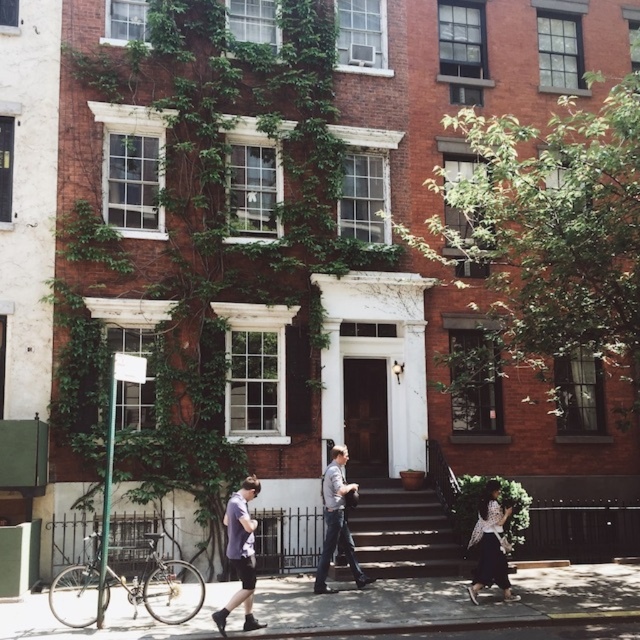
Question: Is green leafy ivy at center positioned before black textured dress at lower right?

Choices:
 (A) yes
 (B) no

Answer: (A)

Question: Observing the image, what is the correct spatial positioning of smooth concrete pavement at center in reference to dark brown wooden stairs at center?

Choices:
 (A) right
 (B) left

Answer: (A)

Question: Is smooth concrete pavement at center below dark brown wooden stairs at center?

Choices:
 (A) no
 (B) yes

Answer: (B)

Question: Considering the real-world distances, which object is closest to the black textured dress at lower right?

Choices:
 (A) green leafy ivy at center
 (B) dark purple t-shirt at lower left
 (C) dark brown wooden stairs at center
 (D) smooth concrete pavement at center

Answer: (D)

Question: Which point is closer to the camera?

Choices:
 (A) (358, 568)
 (B) (481, 506)

Answer: (B)

Question: Which of the following is the farthest from the observer?

Choices:
 (A) (472, 588)
 (B) (364, 518)

Answer: (B)